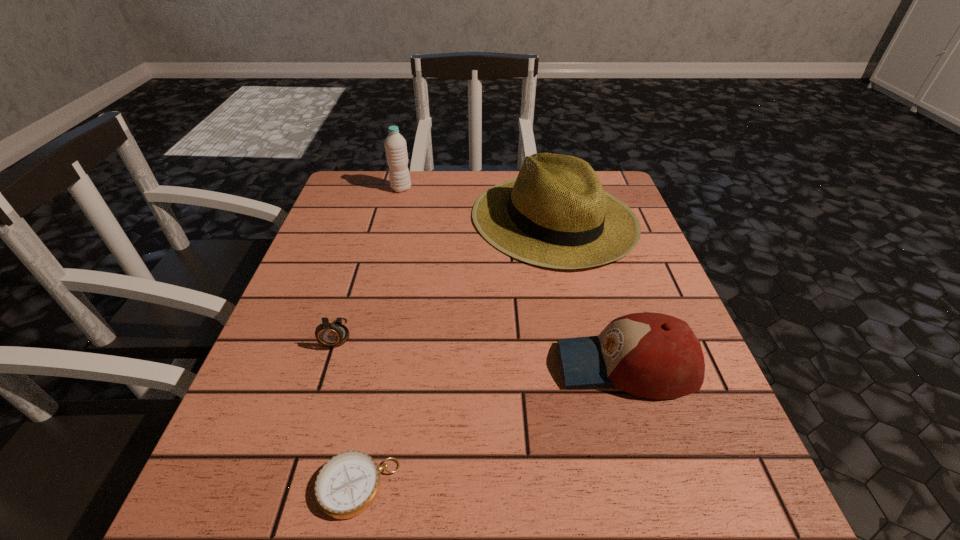
At what (x,y) coordinates should I click in order to perform the action: click on object present at the far left corner. Please return your answer as a coordinate pair (x, y). Image resolution: width=960 pixels, height=540 pixels. Looking at the image, I should click on (395, 145).

Identify the location of object present at the near left corner. Image resolution: width=960 pixels, height=540 pixels. 347,485.

The image size is (960, 540). Identify the location of object that is at the far right corner. (556, 214).

The height and width of the screenshot is (540, 960). What are the coordinates of `vacant area at the far edge of the desktop` in the screenshot? It's located at (x=396, y=205).

The image size is (960, 540). In the image, there is a desktop. Identify the location of vacant space at the near edge. (609, 482).

Find the location of a particular element. Image resolution: width=960 pixels, height=540 pixels. free space at the left edge of the desktop is located at coordinates (258, 382).

Locate an element on the screen. vacant space at the right edge of the desktop is located at coordinates (633, 421).

Image resolution: width=960 pixels, height=540 pixels. Find the location of `blank space at the far left corner of the desktop`. blank space at the far left corner of the desktop is located at coordinates (377, 185).

The image size is (960, 540). In the image, there is a desktop. Identify the location of vacant area at the near left corner. (204, 523).

Identify the location of vacant area that lies between the water bottle and the baseball cap. Image resolution: width=960 pixels, height=540 pixels. (514, 277).